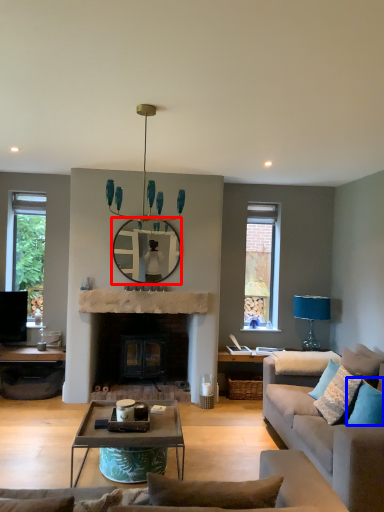
Question: Which object is further to the camera taking this photo, mirror (highlighted by a red box) or pillow (highlighted by a blue box)?

Choices:
 (A) mirror
 (B) pillow

Answer: (A)